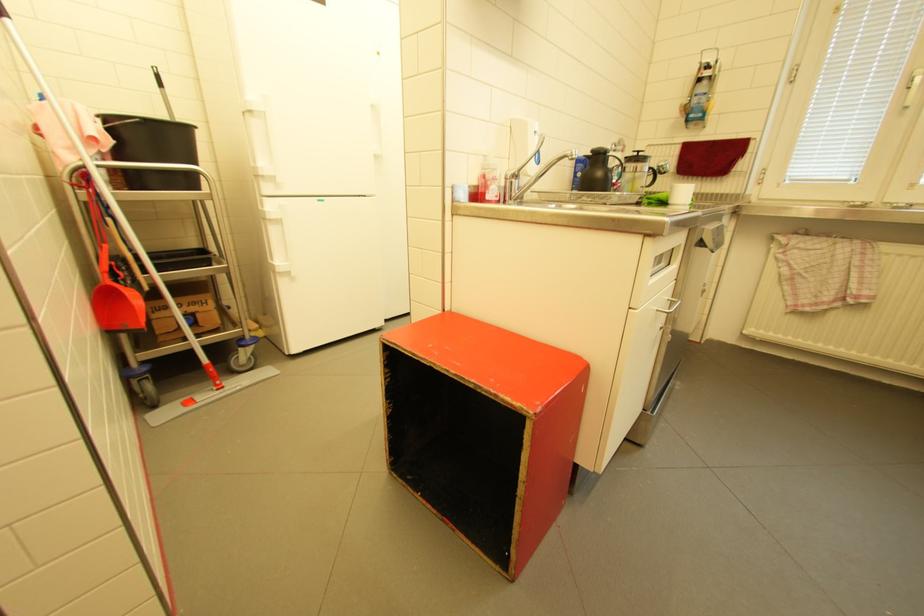
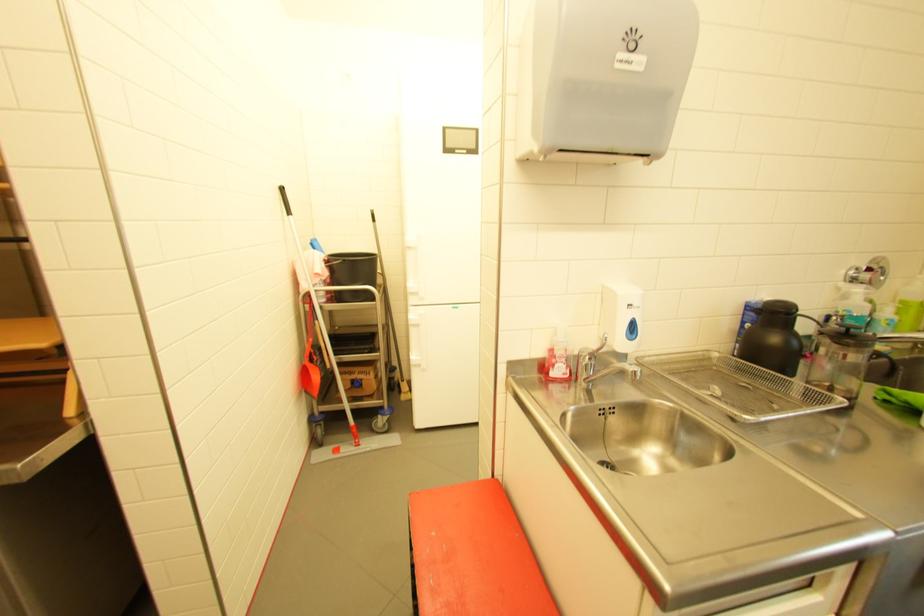
Where in the second image is the point corresponding to (146,121) from the first image?

(347, 261)